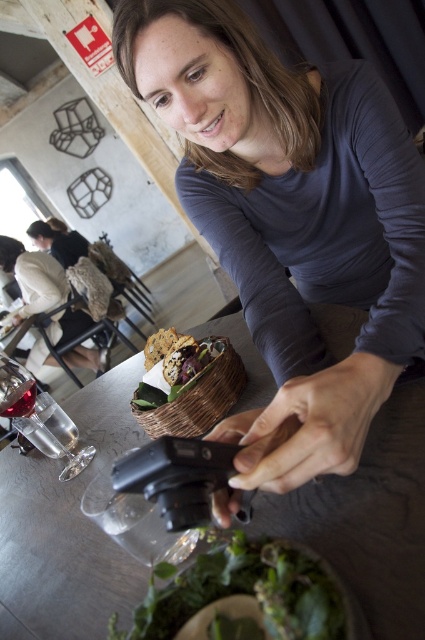
Does smooth wooden table at center appear on the left side of transparent glass at lower left?

In fact, smooth wooden table at center is to the right of transparent glass at lower left.

Is point (314, 531) farther from camera compared to point (56, 440)?

No.

In the scene shown: Who is more forward, (82, 474) or (17, 412)?

Positioned in front is point (82, 474).

Locate an element on the screen. This screenshot has width=425, height=640. smooth wooden table at center is located at coordinates (67, 529).

Looking at this image, between matte black camera at center and translucent glass wine glass at lower left, which one has less height?

With less height is translucent glass wine glass at lower left.

Where is `matte black camera at center`? The height and width of the screenshot is (640, 425). matte black camera at center is located at coordinates (291, 220).

Is green leafy salad at lower center below transparent glass at lower left?

Yes.

Measure the distance between green leafy salad at lower center and camera.

green leafy salad at lower center is 12.80 inches from camera.

Identify the location of green leafy salad at lower center. (241, 596).